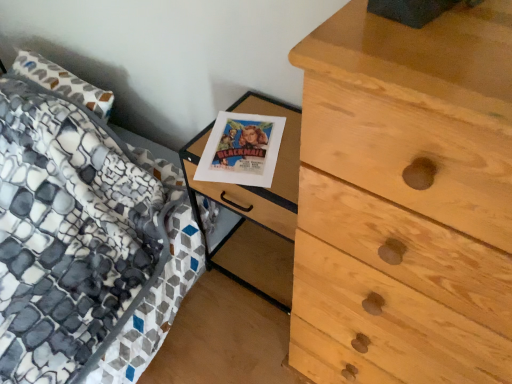
Question: Is light brown wood chest of drawers at right to the left or to the right of patterned fabric bed at left in the image?

Choices:
 (A) right
 (B) left

Answer: (A)

Question: In the image, is light brown wood chest of drawers at right positioned in front of or behind patterned fabric bed at left?

Choices:
 (A) behind
 (B) front

Answer: (B)

Question: Which object is positioned closest to the patterned fabric bed at left?

Choices:
 (A) light brown wood chest of drawers at right
 (B) wooden nightstand at center

Answer: (B)

Question: Estimate the real-world distances between objects in this image. Which object is closer to the light brown wood chest of drawers at right?

Choices:
 (A) wooden nightstand at center
 (B) patterned fabric bed at left

Answer: (A)